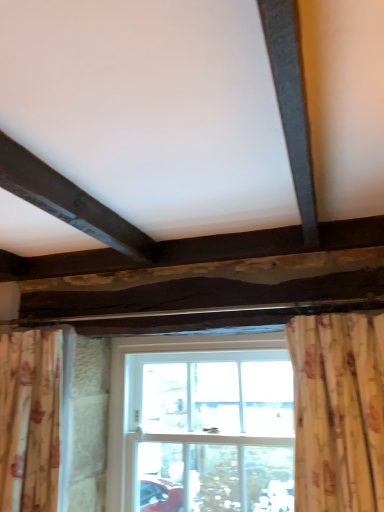
Question: From the image's perspective, is floral fabric curtain at lower left located above or below white wooden window at center?

Choices:
 (A) above
 (B) below

Answer: (A)

Question: From a real-world perspective, is floral fabric curtain at lower left physically located above or below white wooden window at center?

Choices:
 (A) below
 (B) above

Answer: (B)

Question: Relative to white wooden window at center, is floral fabric curtain at lower left in front or behind?

Choices:
 (A) behind
 (B) front

Answer: (B)

Question: Is point (119, 381) positioned closer to the camera than point (41, 483)?

Choices:
 (A) closer
 (B) farther

Answer: (B)

Question: Considering their positions, is white wooden window at center located in front of or behind floral fabric curtain at lower left?

Choices:
 (A) behind
 (B) front

Answer: (A)

Question: From a real-world perspective, is white wooden window at center physically located above or below floral fabric curtain at lower left?

Choices:
 (A) above
 (B) below

Answer: (B)

Question: From the image's perspective, relative to floral fabric curtain at lower left, is white wooden window at center above or below?

Choices:
 (A) above
 (B) below

Answer: (B)